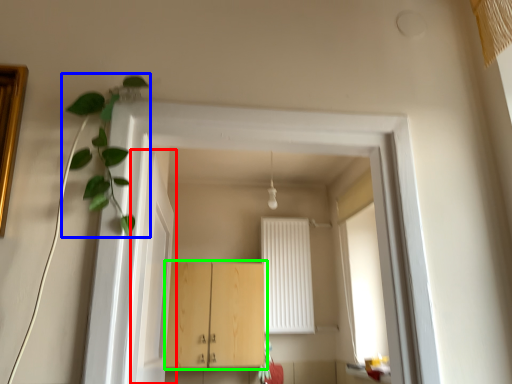
Question: Estimate the real-world distances between objects in this image. Which object is closer to door (highlighted by a red box), plant (highlighted by a blue box) or cabinetry (highlighted by a green box)?

Choices:
 (A) plant
 (B) cabinetry

Answer: (A)